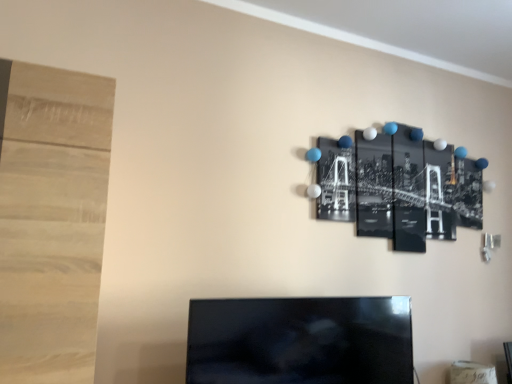
Question: Considering the positions of black glossy photo at upper right and black glossy tv at center in the image, is black glossy photo at upper right wider or thinner than black glossy tv at center?

Choices:
 (A) wide
 (B) thin

Answer: (B)

Question: Considering the positions of black glossy photo at upper right and black glossy tv at center in the image, is black glossy photo at upper right taller or shorter than black glossy tv at center?

Choices:
 (A) short
 (B) tall

Answer: (B)

Question: From a real-world perspective, is black glossy photo at upper right above or below black glossy tv at center?

Choices:
 (A) above
 (B) below

Answer: (A)

Question: Is black glossy tv at center bigger or smaller than black glossy photo at upper right?

Choices:
 (A) small
 (B) big

Answer: (B)

Question: Is black glossy tv at center wider or thinner than black glossy photo at upper right?

Choices:
 (A) wide
 (B) thin

Answer: (A)

Question: Considering the positions of point (310, 301) and point (400, 198), is point (310, 301) closer or farther from the camera than point (400, 198)?

Choices:
 (A) closer
 (B) farther

Answer: (A)

Question: Choose the correct answer: Is black glossy tv at center inside black glossy photo at upper right or outside it?

Choices:
 (A) inside
 (B) outside

Answer: (B)